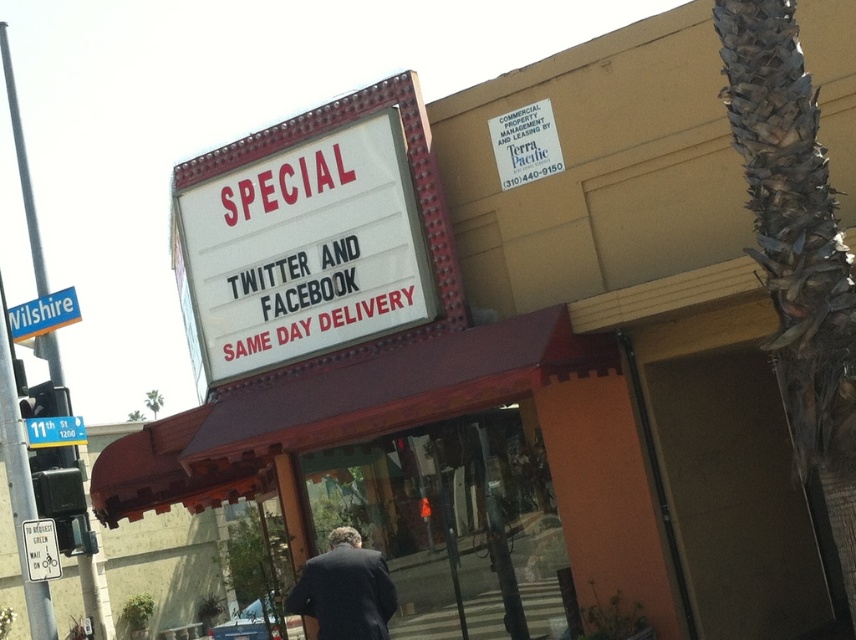
Question: Is white plastic marquee sign at upper center to the right of white plastic sign at lower left from the viewer's perspective?

Choices:
 (A) no
 (B) yes

Answer: (B)

Question: Can you confirm if brown textured palm tree at upper right is thinner than dark blue suit at center?

Choices:
 (A) yes
 (B) no

Answer: (A)

Question: Which object is closer to the camera taking this photo?

Choices:
 (A) white plastic sign at lower left
 (B) brown textured palm tree at upper right
 (C) dark blue suit at center

Answer: (B)

Question: Is dark blue suit at center thinner than white plastic sign at lower left?

Choices:
 (A) no
 (B) yes

Answer: (A)

Question: Which of the following is the farthest from the observer?

Choices:
 (A) (46, 300)
 (B) (22, 522)
 (C) (254, 324)

Answer: (A)

Question: Considering the real-world distances, which object is farthest from the white plastic sign at lower left?

Choices:
 (A) brown textured palm tree at upper right
 (B) white plastic street sign at lower left

Answer: (A)